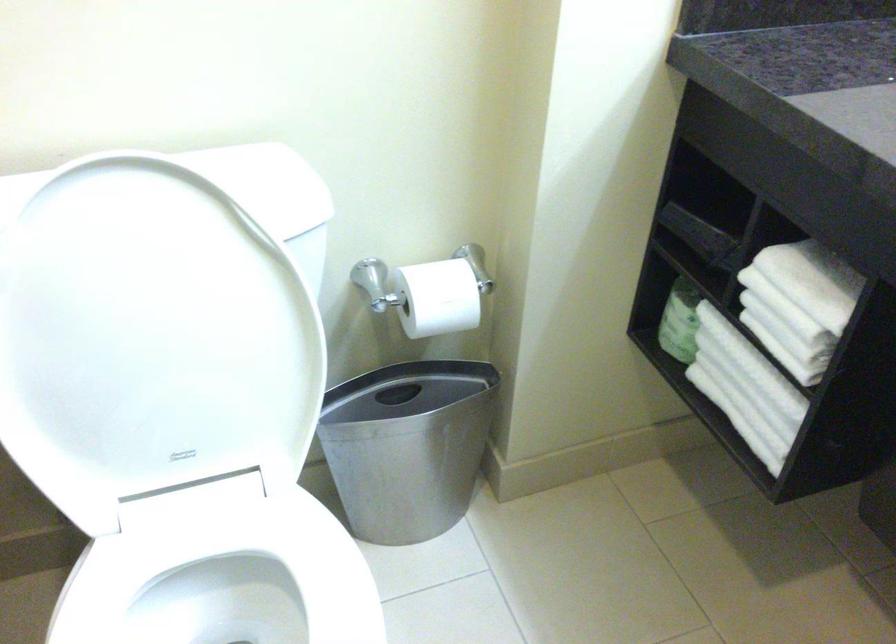
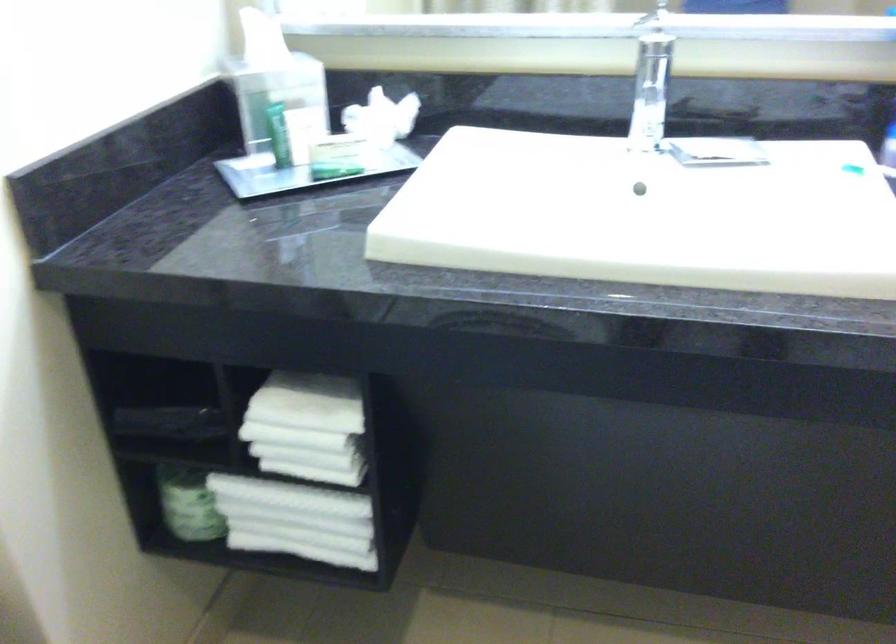
Question: The camera is either moving clockwise (left) or counter-clockwise (right) around the object. The first image is from the beginning of the video and the second image is from the end. Is the camera moving left or right when shooting the video?

Choices:
 (A) Left
 (B) Right

Answer: (A)